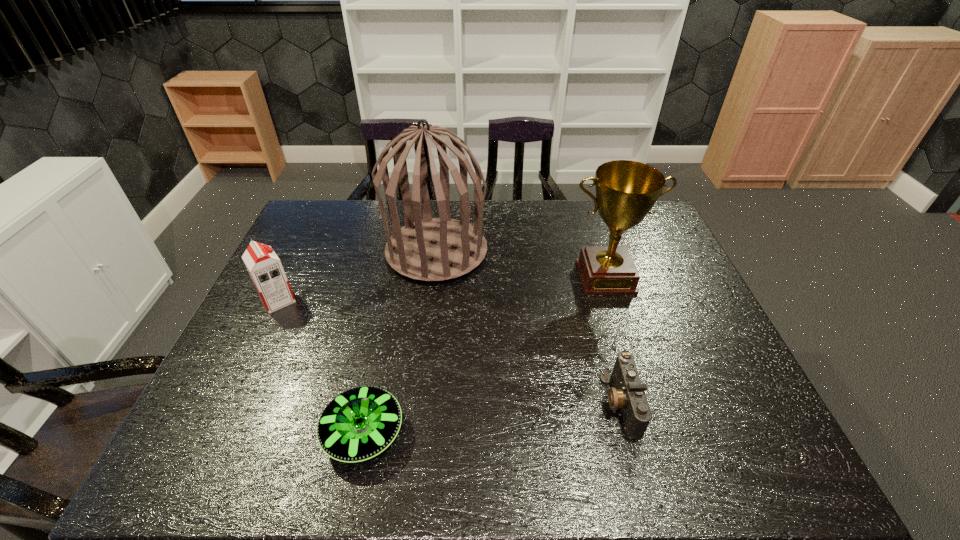
Image resolution: width=960 pixels, height=540 pixels. Identify the location of the tallest object. (430, 249).

The image size is (960, 540). Find the location of `award`. award is located at coordinates (626, 191).

Locate an element on the screen. The width and height of the screenshot is (960, 540). the third tallest object is located at coordinates (x=263, y=265).

This screenshot has height=540, width=960. Find the location of `the leftmost object`. the leftmost object is located at coordinates (263, 265).

Where is `camera`? The image size is (960, 540). camera is located at coordinates (628, 395).

This screenshot has width=960, height=540. I want to click on saucer, so click(358, 424).

The image size is (960, 540). Identify the location of free space located 0.170m on the left of the birdcage. (334, 251).

This screenshot has width=960, height=540. I want to click on free space located on the plaque of the fourth shortest object, so click(x=630, y=355).

Image resolution: width=960 pixels, height=540 pixels. What are the coordinates of `free space located on the right of the third tallest object` in the screenshot? It's located at (339, 300).

Locate an element on the screen. The height and width of the screenshot is (540, 960). free space located 0.280m on the front-facing side of the camera is located at coordinates (483, 403).